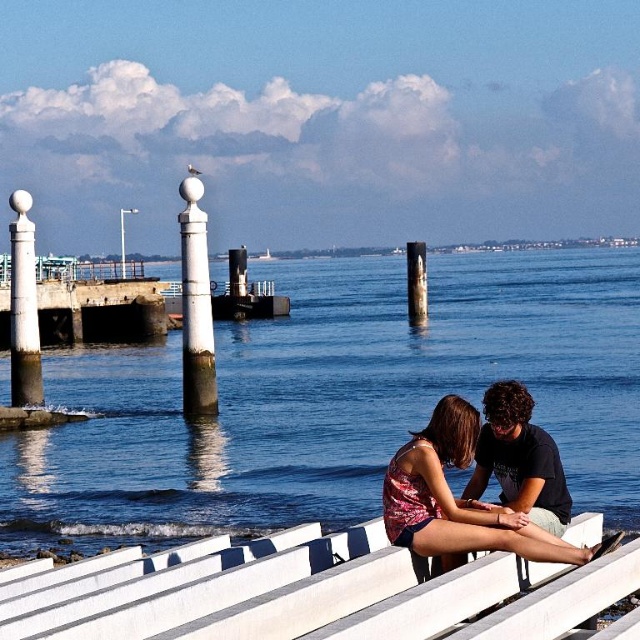
Question: Is the position of pink floral tank top at center more distant than that of dark blue t-shirt at center?

Choices:
 (A) no
 (B) yes

Answer: (A)

Question: Does blue water at center appear on the left side of smooth concrete post at center?

Choices:
 (A) yes
 (B) no

Answer: (A)

Question: Which point is farther to the camera?

Choices:
 (A) blue water at center
 (B) smooth concrete post at center
 (C) white polished stone post at center-left

Answer: (B)

Question: Does blue water at center have a larger size compared to white polished stone post at center-left?

Choices:
 (A) yes
 (B) no

Answer: (A)

Question: Estimate the real-world distances between objects in this image. Which object is farther from the smooth concrete post at center?

Choices:
 (A) blue water at center
 (B) pink floral tank top at center

Answer: (B)

Question: Which of the following is the farthest from the observer?

Choices:
 (A) white polished stone post at center-left
 (B) dark blue t-shirt at center
 (C) blue water at center
 (D) white polished stone post at left

Answer: (D)